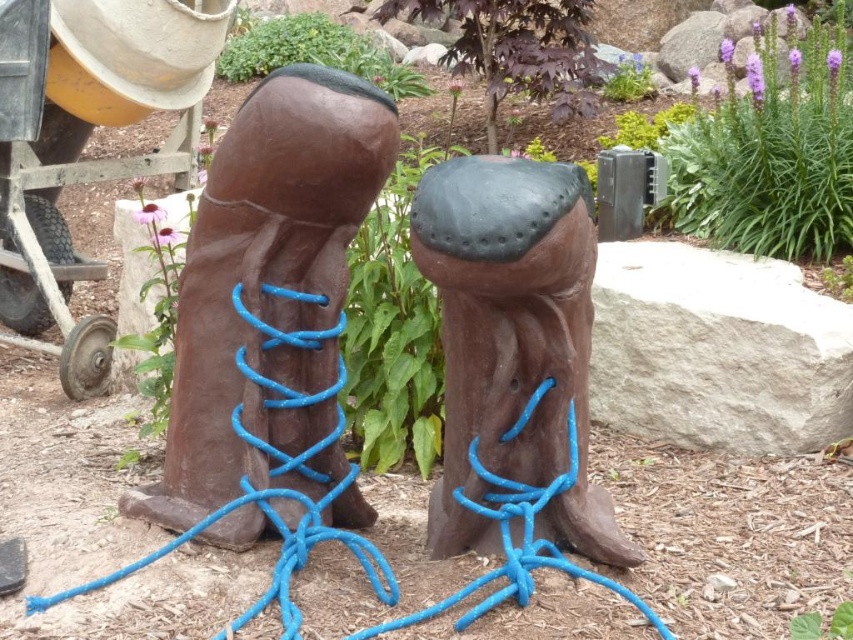
Based on the photo, you are an artist planning to paint a scene that includes the brown wood boot at center and the brown matte wood at center. You need to ensure the proportions between them are accurate. Which object is wider?

The brown wood boot at center is wider than the brown matte wood at center.

You are a gardener who wants to place a 10 inch tall flower pot between the brown wood boot at center and the brown matte wood at center. Is there enough space for the flower pot to fit between them?

The distance between the brown wood boot at center and the brown matte wood at center is 12.10 inches, so yes, the 10 inch tall flower pot can fit between them since the space is larger than the pot.